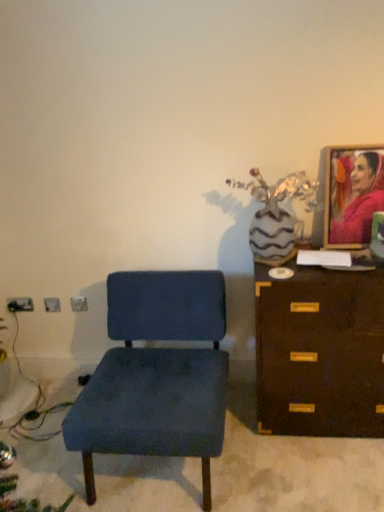
Question: In the image, is velvet blue chair at center on the left side or the right side of matte pink fabric portrait at upper right?

Choices:
 (A) left
 (B) right

Answer: (A)

Question: Which is correct: velvet blue chair at center is inside matte pink fabric portrait at upper right, or outside of it?

Choices:
 (A) outside
 (B) inside

Answer: (A)

Question: Which object is the closest to the brown wooden chest of drawers at right?

Choices:
 (A) velvet blue chair at center
 (B) matte pink fabric portrait at upper right

Answer: (A)

Question: Estimate the real-world distances between objects in this image. Which object is farther from the matte pink fabric portrait at upper right?

Choices:
 (A) velvet blue chair at center
 (B) brown wooden chest of drawers at right

Answer: (A)